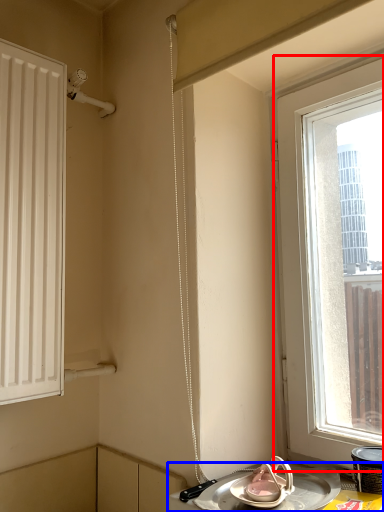
Question: Which of the following is the farthest to the observer, window (highlighted by a red box) or table (highlighted by a blue box)?

Choices:
 (A) window
 (B) table

Answer: (A)